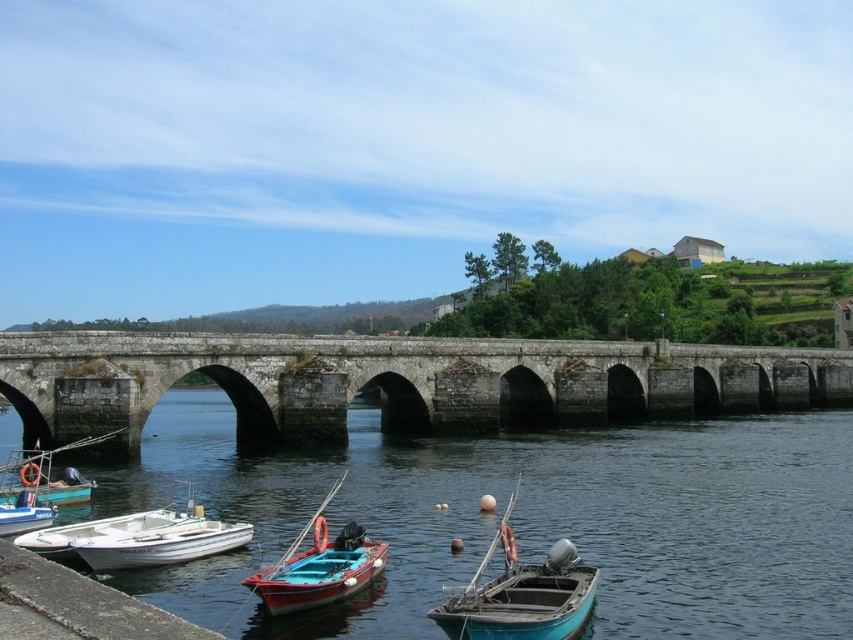
Who is shorter, clear water at center or white matte boat at lower left?

white matte boat at lower left is shorter.

Does point (683, 576) lie behind point (178, 531)?

No, (683, 576) is closer to viewer.

The width and height of the screenshot is (853, 640). What are the coordinates of `clear water at center` in the screenshot? It's located at [524, 518].

Can you confirm if white matte boat at lower left is positioned to the left of teal matte boat at lower left?

No, white matte boat at lower left is not to the left of teal matte boat at lower left.

Does white matte boat at lower left appear under teal matte boat at lower left?

Yes.

Measure the distance between white matte boat at lower left and camera.

white matte boat at lower left and camera are 40.77 meters apart.

What are the coordinates of `white matte boat at lower left` in the screenshot? It's located at (161, 541).

Does point (323, 593) lie in front of point (39, 508)?

Yes, point (323, 593) is closer to viewer.

Between wooden boat at center and white plastic boat at lower left, which one appears on the left side from the viewer's perspective?

From the viewer's perspective, white plastic boat at lower left appears more on the left side.

Is point (335, 580) positioned in front of point (4, 506)?

That is True.

The height and width of the screenshot is (640, 853). Identify the location of wooden boat at center. (x=318, y=564).